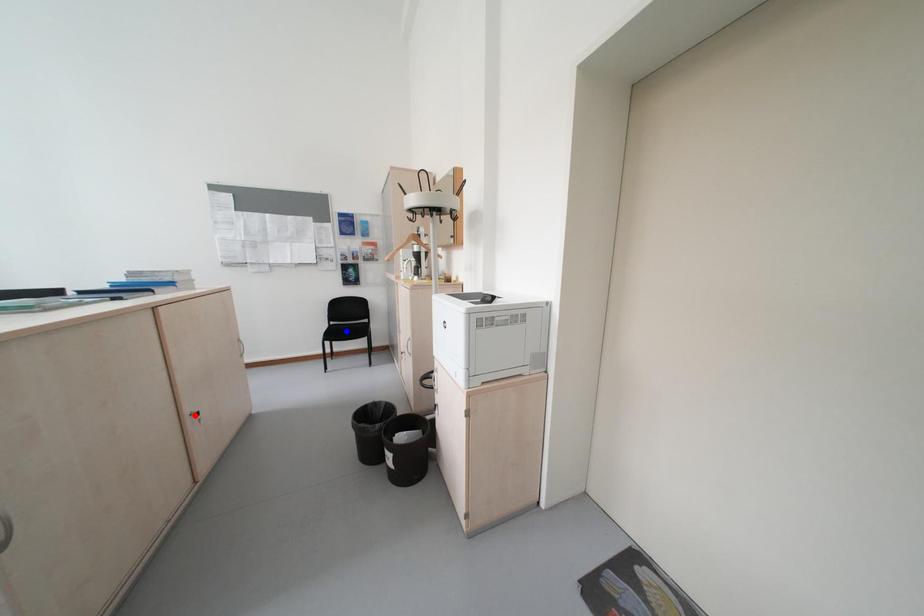
Question: In the image, two points are highlighted. Which point is nearer to the camera? Reply with the corresponding letter.

Choices:
 (A) blue point
 (B) red point

Answer: (B)